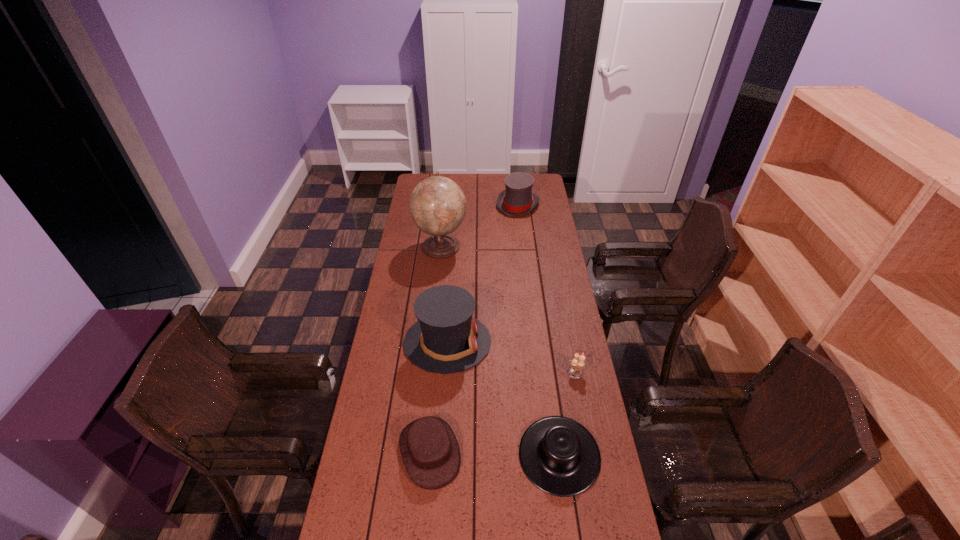
Where is `vacant region located 0.120m on the back of the candle holder`? vacant region located 0.120m on the back of the candle holder is located at coordinates (569, 341).

Where is `object at the far edge`? The image size is (960, 540). object at the far edge is located at coordinates (518, 199).

This screenshot has height=540, width=960. I want to click on globe that is at the left edge, so click(437, 204).

Identify the location of candle holder at the right edge. The height and width of the screenshot is (540, 960). (577, 363).

Identify the location of object situated at the far right corner. (518, 199).

At what (x,y) coordinates should I click in order to perform the action: click on vacant position at the far edge of the desktop. Please return your answer as a coordinate pair (x, y). The height and width of the screenshot is (540, 960). Looking at the image, I should click on (502, 188).

The height and width of the screenshot is (540, 960). Identify the location of free point at the right edge. (561, 252).

Locate an element on the screen. The image size is (960, 540). vacant space at the far right corner of the desktop is located at coordinates (545, 190).

Where is `free space between the tallest object and the farthest hat`? This screenshot has width=960, height=540. free space between the tallest object and the farthest hat is located at coordinates (479, 226).

This screenshot has height=540, width=960. I want to click on object identified as the second closest to the candle holder, so click(x=446, y=339).